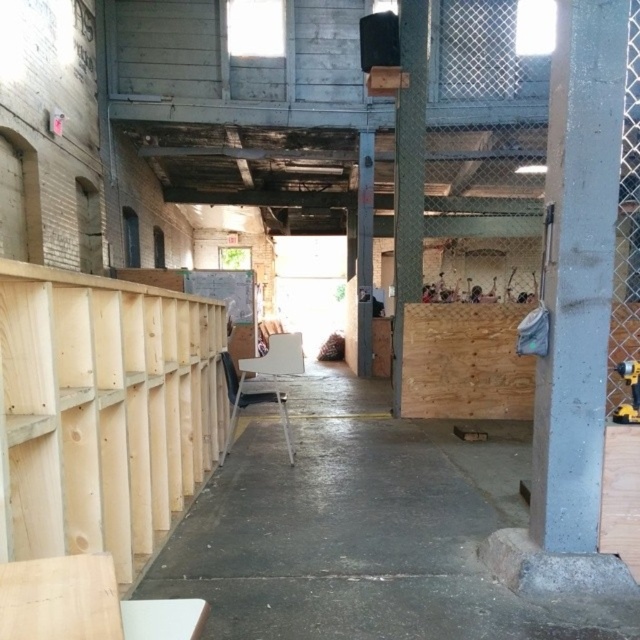
You are a construction worker who needs to place a heavy tool on a stable surface. You see the gray concrete at center and the metallic yellow drill at right. Which surface is more suitable for placing the heavy tool?

The gray concrete at center is more suitable for placing the heavy tool because it is a stable surface, whereas the metallic yellow drill at right is an object and not a surface.